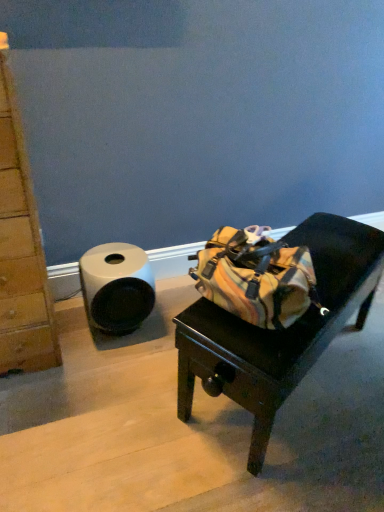
At what (x,y) coordinates should I click in order to perform the action: click on vacant space situated above multicolored fabric bag at center (from a real-world perspective). Please return your answer as a coordinate pair (x, y). Image resolution: width=384 pixels, height=512 pixels. Looking at the image, I should click on click(x=330, y=240).